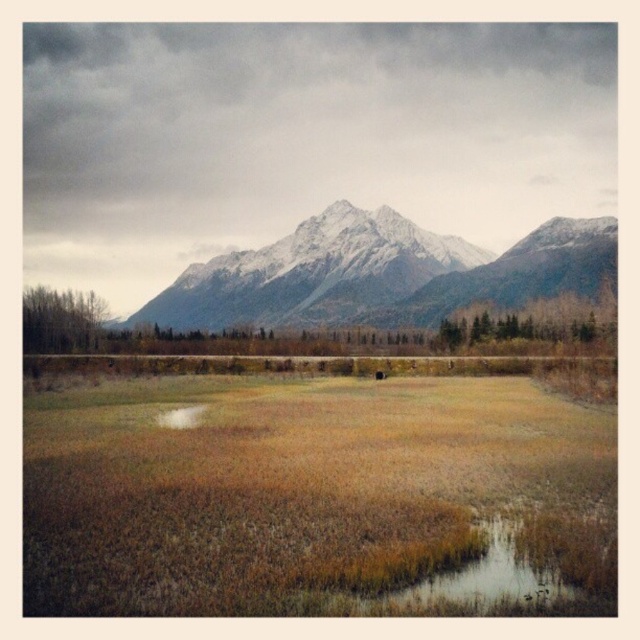
You are a hiker planning to cross the brown dry grass at center and the snowy granite mountain range at upper center. Which terrain is lower to the ground?

The brown dry grass at center is positioned under the snowy granite mountain range at upper center, so the brown dry grass at center is lower to the ground.

From the picture: You are a photographer standing at the edge of the wetland. You want to capture a closeup shot of the brown dry grass at center. Considering your camera has a minimum focusing distance of 10 meters, will you be able to take the photo without moving closer?

The brown dry grass at center is 40.31 meters away from camera, so yes, you can take the closeup shot since the distance is greater than the minimum focusing distance of 10 meters.

You are standing at the point marked by point [312,496] in the image. Looking around, you see brown dry grass at center. What is the immediate terrain like around your current location?

The immediate terrain around point [312,496] is brown dry grass at center, which suggests the area is part of a dry or arid section of the wetland vegetation.